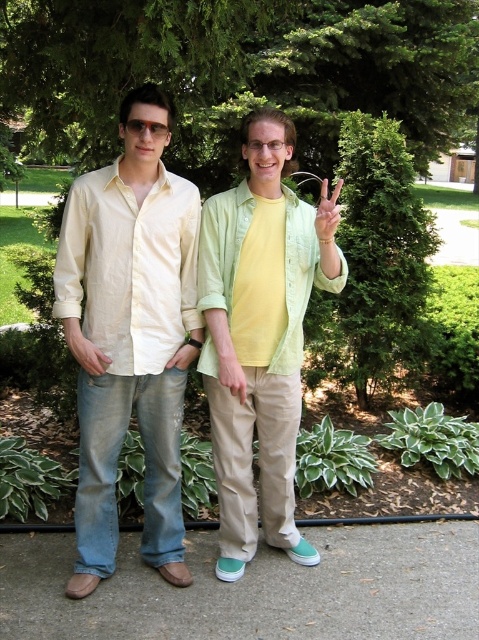
Locate an element on the screen. matte yellow shirt at center is located at coordinates (129, 337).

Describe the element at coordinates (129, 337) in the screenshot. The height and width of the screenshot is (640, 479). I see `matte yellow shirt at center` at that location.

What do you see at coordinates (129, 337) in the screenshot?
I see `matte yellow shirt at center` at bounding box center [129, 337].

The width and height of the screenshot is (479, 640). What are the coordinates of `matte yellow shirt at center` in the screenshot? It's located at (129, 337).

Which is in front, point (95, 240) or point (152, 131)?

Point (152, 131) is in front.

Who is shorter, matte yellow shirt at center or matte black glasses at center?

matte black glasses at center is shorter.

Where is `matte yellow shirt at center`? This screenshot has width=479, height=640. matte yellow shirt at center is located at coordinates (129, 337).

Identify the location of matte yellow shirt at center. (129, 337).

Does gray concrete pavement at lower center lie behind light green fabric shirt at center?

No, gray concrete pavement at lower center is in front of light green fabric shirt at center.

Does gray concrete pavement at lower center have a greater height compared to light green fabric shirt at center?

Incorrect, gray concrete pavement at lower center's height is not larger of light green fabric shirt at center's.

Image resolution: width=479 pixels, height=640 pixels. What do you see at coordinates (257, 589) in the screenshot? I see `gray concrete pavement at lower center` at bounding box center [257, 589].

This screenshot has height=640, width=479. In order to click on gray concrete pavement at lower center in this screenshot , I will do `click(257, 589)`.